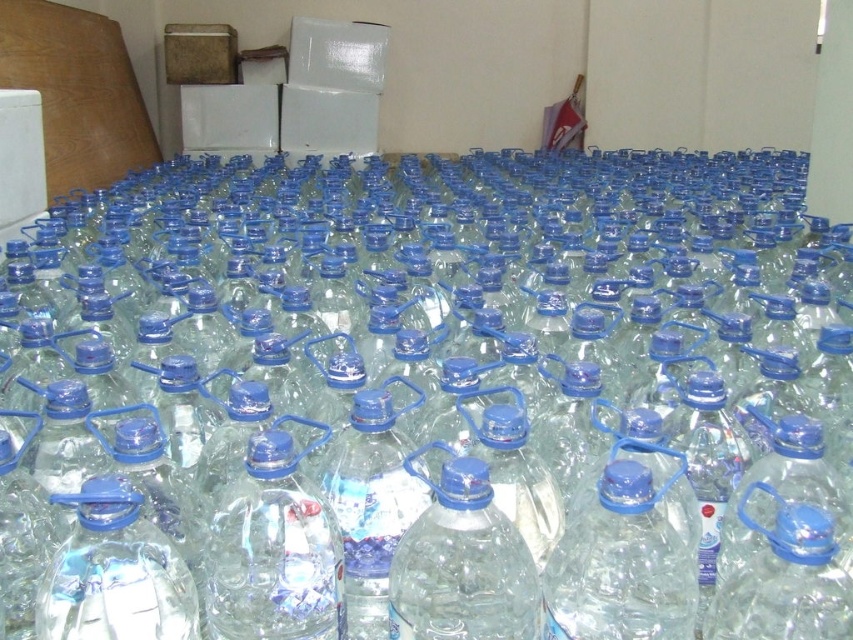
Question: Can you confirm if clear plastic bottle at center is smaller than transparent plastic bottle at center?

Choices:
 (A) no
 (B) yes

Answer: (A)

Question: Is clear plastic bottle at center bigger than transparent plastic bottle at center?

Choices:
 (A) no
 (B) yes

Answer: (B)

Question: Which point appears closest to the camera in this image?

Choices:
 (A) (270, 612)
 (B) (531, 561)

Answer: (B)

Question: Is clear plastic bottle at center thinner than transparent plastic bottle at center?

Choices:
 (A) no
 (B) yes

Answer: (A)